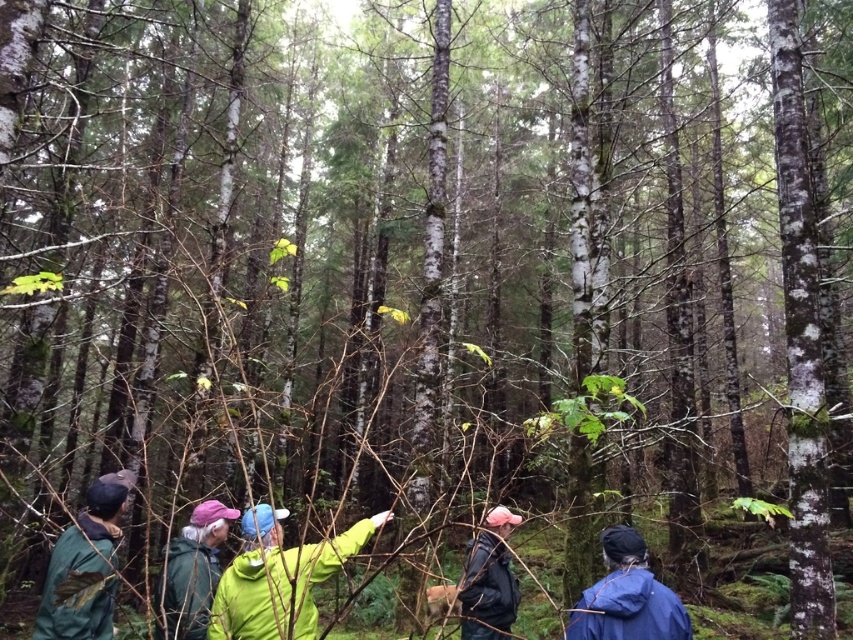
Question: Which object appears closest to the camera in this image?

Choices:
 (A) dark gray jacket at lower right
 (B) green fabric jacket at lower center
 (C) blue matte jacket at lower right
 (D) green matte jacket at lower left

Answer: (B)

Question: Does blue matte jacket at lower right have a smaller size compared to green fabric jacket at lower center?

Choices:
 (A) yes
 (B) no

Answer: (A)

Question: Which object appears closest to the camera in this image?

Choices:
 (A) green fabric jacket at lower center
 (B) blue matte jacket at lower right
 (C) green matte jacket at center
 (D) dark gray jacket at lower right

Answer: (C)

Question: Which object is the farthest from the green fabric jacket at lower center?

Choices:
 (A) blue matte jacket at lower right
 (B) green matte jacket at lower left
 (C) green matte jacket at center
 (D) dark gray jacket at lower right

Answer: (A)

Question: Considering the relative positions of green fabric jacket at lower center and dark gray jacket at lower right in the image provided, where is green fabric jacket at lower center located with respect to dark gray jacket at lower right?

Choices:
 (A) left
 (B) right

Answer: (A)

Question: Does green matte jacket at center have a smaller size compared to dark gray jacket at lower right?

Choices:
 (A) yes
 (B) no

Answer: (B)